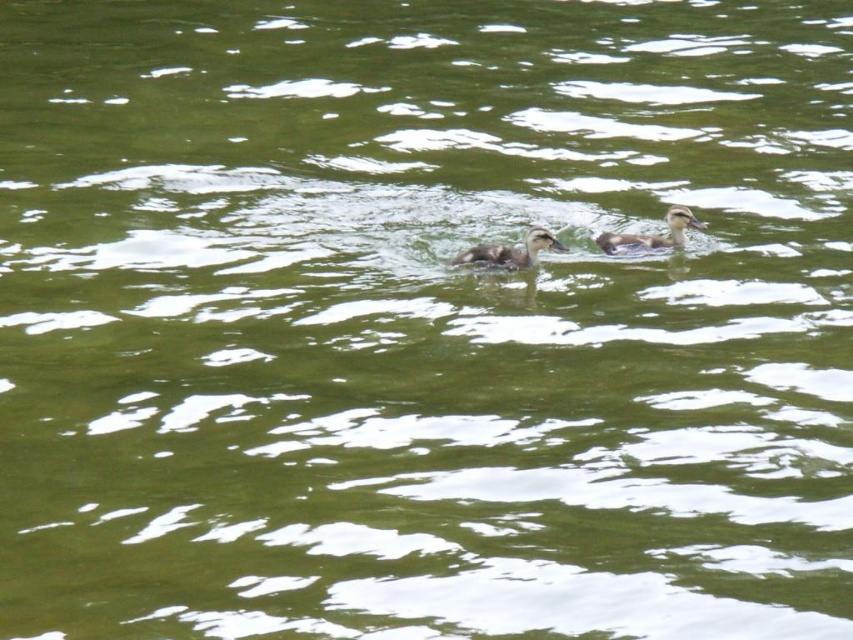
Consider the image. You are a photographer trying to capture a closeup of the brown fuzzy duckling at center. You have a zoom lens that can focus on a specific point. You want to ensure that the point you select will land on the duckling. Is the point at coordinate (509, 252) on the brown fuzzy duckling at center?

Yes, the point at coordinate (509, 252) is on the brown fuzzy duckling at center according to the description.

You are a wildlife photographer aiming to capture a closeup shot of the ducklings. You have a camera lens that can focus on objects within a 1 meter range. If you position yourself directly above the water, which duckling would be easier to focus on, the brown fuzzy duckling at center or the brown speckled duckling at upper center?

The brown fuzzy duckling at center is larger in size compared to the brown speckled duckling at upper center, so it would be easier to focus on the brown fuzzy duckling at center with the camera lens within 1 meter range.